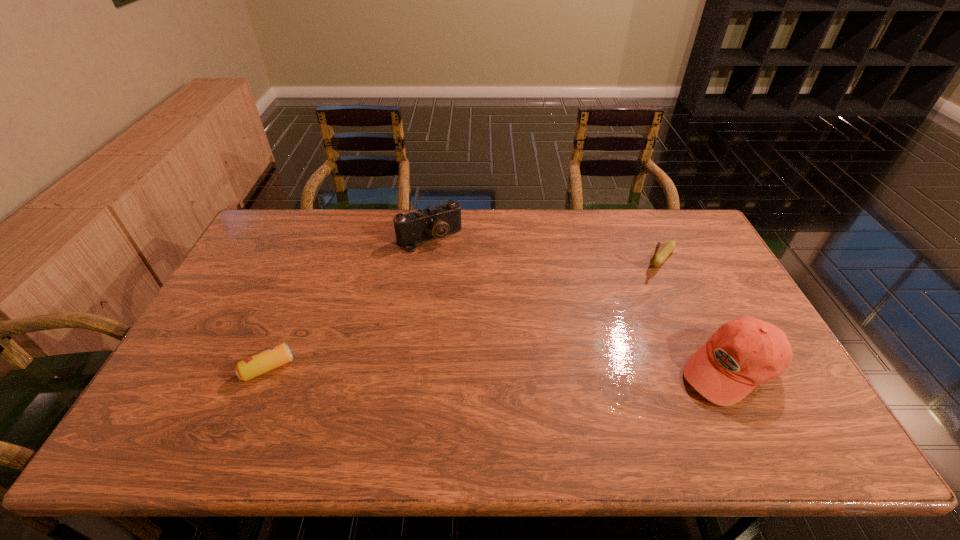
Where is `the shortest object`? The width and height of the screenshot is (960, 540). the shortest object is located at coordinates (256, 365).

At what (x,y) coordinates should I click in order to perform the action: click on the leftmost object. Please return your answer as a coordinate pair (x, y). The height and width of the screenshot is (540, 960). Looking at the image, I should click on (256, 365).

Where is `baseball cap`? This screenshot has height=540, width=960. baseball cap is located at coordinates (745, 352).

At what (x,y) coordinates should I click in order to perform the action: click on the third object from right to left. Please return your answer as a coordinate pair (x, y). This screenshot has width=960, height=540. Looking at the image, I should click on (436, 221).

What are the coordinates of `banana` in the screenshot? It's located at (659, 257).

Identify the location of free point located 0.180m on the back of the shortest object. (296, 303).

Where is `vacant space located 0.310m on the front-facing side of the camera`? The height and width of the screenshot is (540, 960). vacant space located 0.310m on the front-facing side of the camera is located at coordinates (480, 313).

Image resolution: width=960 pixels, height=540 pixels. What are the coordinates of `free space located 0.260m on the front-facing side of the camera` in the screenshot? It's located at (473, 301).

Locate an element on the screen. Image resolution: width=960 pixels, height=540 pixels. free location located 0.100m on the front-facing side of the camera is located at coordinates (453, 269).

Find the location of `vacant area located at the stem of the banana`. vacant area located at the stem of the banana is located at coordinates (613, 313).